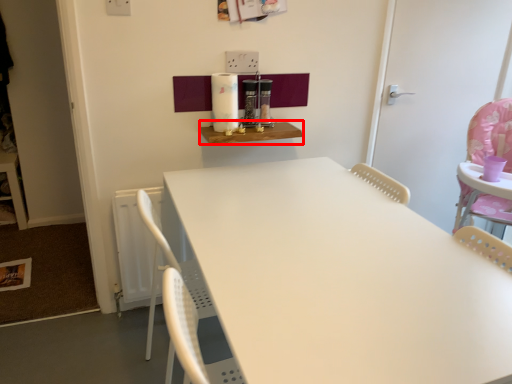
Question: From the image, what is the correct spatial relationship of table (annotated by the red box) in relation to door?

Choices:
 (A) right
 (B) left

Answer: (B)